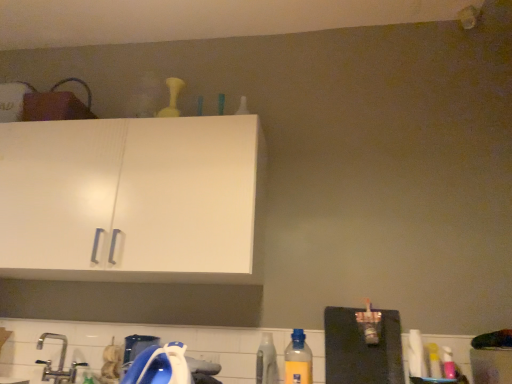
Question: From a real-world perspective, is yellow matte bottle at upper center, which is counted as the 1th bottle, starting from the back, positioned over translucent plastic bottle at lower center, the 2th bottle positioned from the right, based on gravity?

Choices:
 (A) no
 (B) yes

Answer: (B)

Question: From a real-world perspective, is yellow matte bottle at upper center, which is counted as the 1th bottle, starting from the back, below translucent plastic bottle at lower center, the 2th bottle in the front-to-back sequence?

Choices:
 (A) no
 (B) yes

Answer: (A)

Question: Is yellow matte bottle at upper center, placed as the 3th bottle when sorted from front to back, thinner than translucent plastic bottle at lower center, the 2th bottle in the front-to-back sequence?

Choices:
 (A) no
 (B) yes

Answer: (B)

Question: Does yellow matte bottle at upper center, the 3th bottle when ordered from right to left, come behind translucent plastic bottle at lower center, which is the 2th bottle from back to front?

Choices:
 (A) yes
 (B) no

Answer: (A)

Question: Does yellow matte bottle at upper center, placed as the 3th bottle when sorted from front to back, have a larger size compared to translucent plastic bottle at lower center, the 2th bottle positioned from the right?

Choices:
 (A) yes
 (B) no

Answer: (A)

Question: From a real-world perspective, is yellow matte bottle at upper center, marked as the first bottle in a left-to-right arrangement, positioned above or below translucent plastic bottle at lower center, placed as the first bottle when sorted from bottom to top?

Choices:
 (A) above
 (B) below

Answer: (A)

Question: Considering the positions of point click(x=169, y=114) and point click(x=269, y=382), is point click(x=169, y=114) closer or farther from the camera than point click(x=269, y=382)?

Choices:
 (A) closer
 (B) farther

Answer: (B)

Question: In terms of width, does yellow matte bottle at upper center, which is counted as the 1th bottle, starting from the back, look wider or thinner when compared to translucent plastic bottle at lower center, the 2th bottle positioned from the right?

Choices:
 (A) thin
 (B) wide

Answer: (A)

Question: Choose the correct answer: Is yellow matte bottle at upper center, the first bottle in the top-to-bottom sequence, inside translucent plastic bottle at lower center, which is the 2th bottle from back to front, or outside it?

Choices:
 (A) outside
 (B) inside

Answer: (A)

Question: Is yellow plastic bottle at lower center, the 1th bottle in the right-to-left sequence, wider or thinner than yellow matte bottle at upper center, the first bottle in the top-to-bottom sequence?

Choices:
 (A) wide
 (B) thin

Answer: (B)

Question: Considering the relative positions of yellow plastic bottle at lower center, which is counted as the third bottle, starting from the left, and yellow matte bottle at upper center, placed as the 3th bottle when sorted from front to back, in the image provided, is yellow plastic bottle at lower center, which is counted as the third bottle, starting from the left, to the left or to the right of yellow matte bottle at upper center, placed as the 3th bottle when sorted from front to back,?

Choices:
 (A) left
 (B) right

Answer: (B)

Question: From the image's perspective, relative to yellow matte bottle at upper center, the third bottle positioned from the bottom, is yellow plastic bottle at lower center, which is the 2th bottle from top to bottom, above or below?

Choices:
 (A) below
 (B) above

Answer: (A)

Question: Choose the correct answer: Is yellow plastic bottle at lower center, which is the 2th bottle from top to bottom, inside yellow matte bottle at upper center, the first bottle in the top-to-bottom sequence, or outside it?

Choices:
 (A) inside
 (B) outside

Answer: (B)

Question: Based on their positions, is silver metallic faucet at lower left located to the left or right of translucent plastic bottle at lower center, which is the 2th bottle from back to front?

Choices:
 (A) left
 (B) right

Answer: (A)

Question: From a real-world perspective, is silver metallic faucet at lower left above or below translucent plastic bottle at lower center, the 2th bottle positioned from the right?

Choices:
 (A) below
 (B) above

Answer: (A)